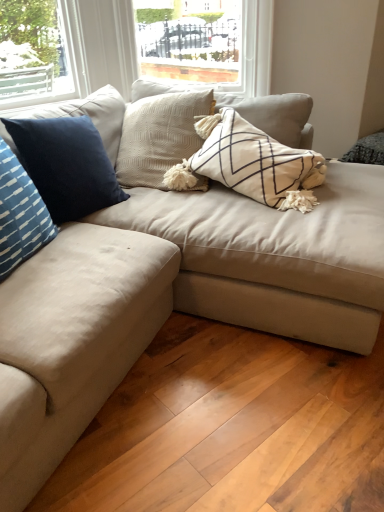
Question: Is blue velvet pillow at left, which ranks as the first pillow in back-to-front order, inside the boundaries of suede beige couch at center, or outside?

Choices:
 (A) inside
 (B) outside

Answer: (A)

Question: Is blue velvet pillow at left, the 2th pillow in the front-to-back sequence, in front of or behind suede beige couch at center in the image?

Choices:
 (A) behind
 (B) front

Answer: (A)

Question: Which object is the farthest from the blue velvet pillow at left, which ranks as the first pillow in back-to-front order?

Choices:
 (A) suede beige couch at center
 (B) blue striped pillow at left, the 1th pillow viewed from the front

Answer: (A)

Question: Estimate the real-world distances between objects in this image. Which object is farther from the blue striped pillow at left, arranged as the second pillow when viewed from the back?

Choices:
 (A) blue velvet pillow at left, the 2th pillow in the front-to-back sequence
 (B) suede beige couch at center

Answer: (B)